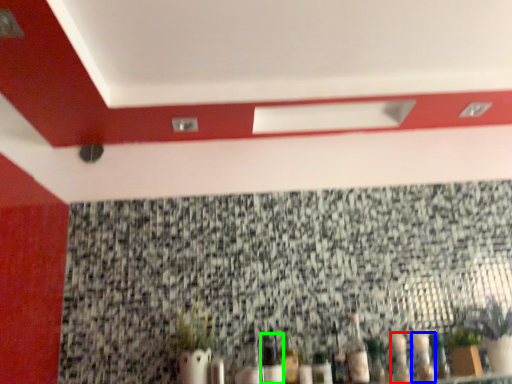
Question: Based on their relative distances, which object is nearer to bottle (highlighted by a red box)? Choose from bottle (highlighted by a blue box) and bottle (highlighted by a green box).

Choices:
 (A) bottle
 (B) bottle

Answer: (A)